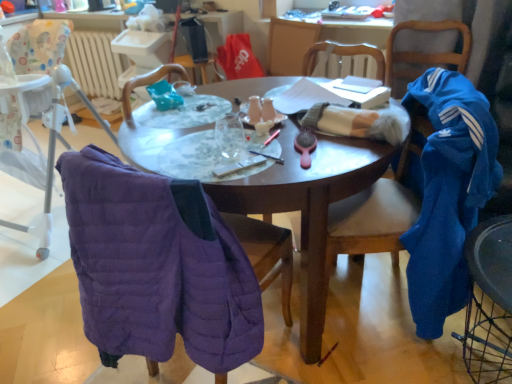
Question: Based on their positions, is purple quilted jacket at left, the 4th chair in the right-to-left sequence, located to the left or right of matte black pen at center?

Choices:
 (A) right
 (B) left

Answer: (B)

Question: From a real-world perspective, is purple quilted jacket at left, the 4th chair in the right-to-left sequence, positioned above or below matte black pen at center?

Choices:
 (A) below
 (B) above

Answer: (A)

Question: Estimate the real-world distances between objects in this image. Which object is farther from the velvet blue chair at right, arranged as the fourth chair when viewed from the left?

Choices:
 (A) blue fleece jacket at right, positioned as the third chair in right-to-left order
 (B) purple quilted jacket at left, the 4th chair in the right-to-left sequence
 (C) wooden table at center
 (D) white fuzzy blanket at center, which is the second clothing from right to left
 (E) purple quilted vest at left, which appears as the 5th chair when viewed from the right

Answer: (E)

Question: Which is farther from the wooden table at center?

Choices:
 (A) blue fleece jacket at right, the third chair viewed from the left
 (B) purple quilted jacket at left, the 4th chair in the right-to-left sequence
 (C) purple quilted vest at left, which appears as the 5th chair when viewed from the right
 (D) matte black pen at center
 (E) white fuzzy blanket at center, which is the second clothing from right to left

Answer: (C)